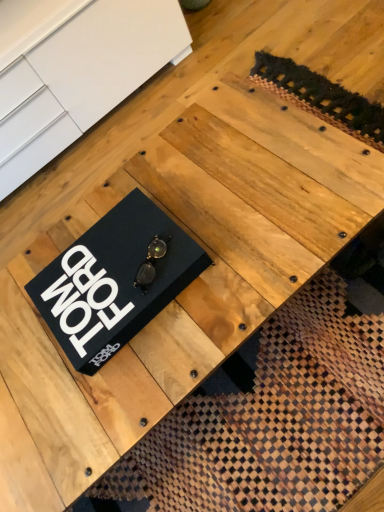
Image resolution: width=384 pixels, height=512 pixels. What are the coordinates of `free space to the left of black matte box at center` in the screenshot? It's located at (30, 373).